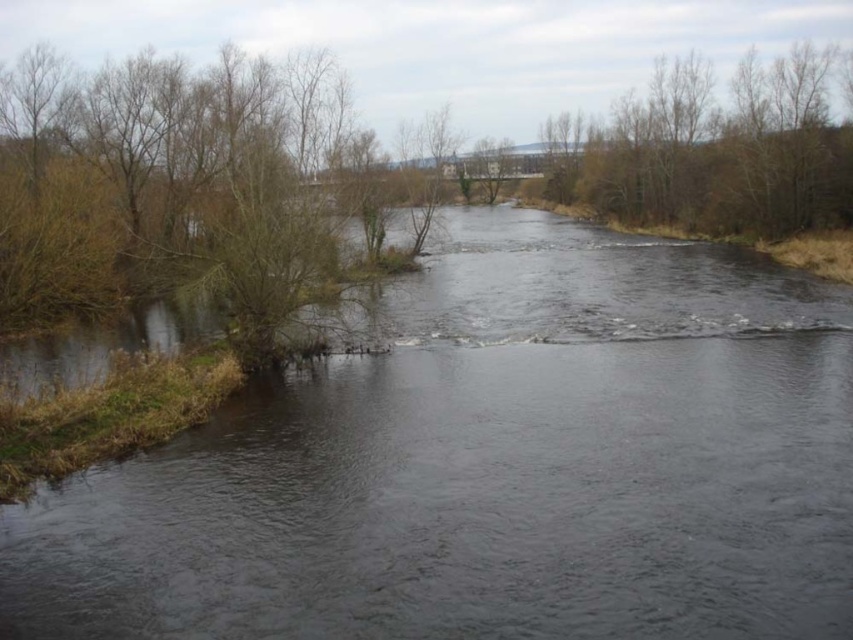
Can you confirm if dark water at center is taller than brown leafy trees at upper right?

Incorrect, dark water at center's height is not larger of brown leafy trees at upper right's.

Looking at this image, which is below, dark water at center or brown leafy trees at upper right?

dark water at center is lower down.

Who is more forward, [693,419] or [769,227]?

Point [693,419] is in front.

At what (x,y) coordinates should I click in order to perform the action: click on dark water at center. Please return your answer as a coordinate pair (x, y). This screenshot has height=640, width=853. Looking at the image, I should click on (492, 465).